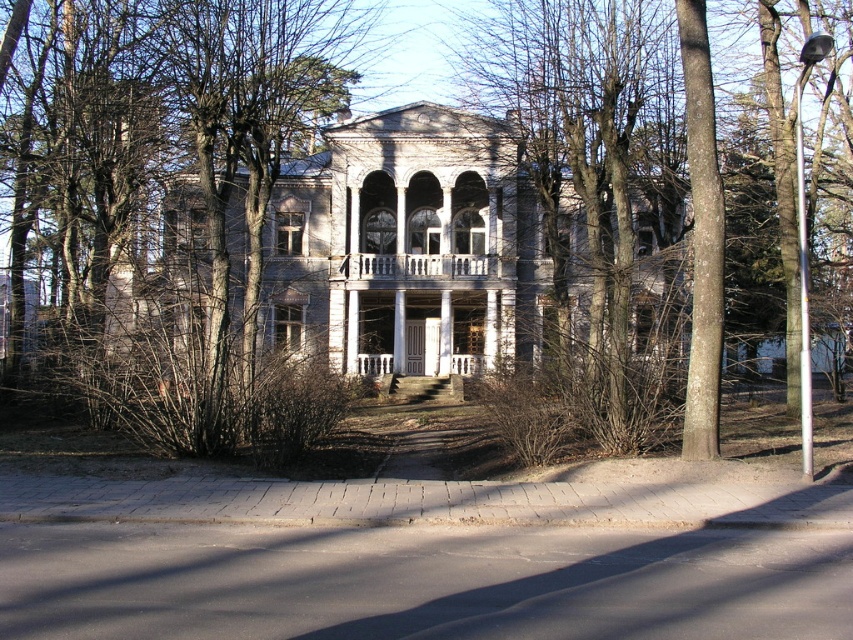
Question: Is brown bark tree at center thinner than white wooden porch at center?

Choices:
 (A) no
 (B) yes

Answer: (A)

Question: Does white wooden porch at center appear on the right side of white painted wood porch at center?

Choices:
 (A) no
 (B) yes

Answer: (B)

Question: Based on their relative distances, which object is farther from the brown bark tree at center?

Choices:
 (A) white painted wood porch at center
 (B) gray stone mansion at center
 (C) white wooden porch at center

Answer: (A)

Question: Which object is the farthest from the white painted wood porch at center?

Choices:
 (A) brown bark tree at center
 (B) white wooden porch at center

Answer: (A)

Question: Which point is farther to the camera?

Choices:
 (A) white wooden porch at center
 (B) brown bark tree at center
 (C) white painted wood porch at center
 (D) gray stone mansion at center

Answer: (A)

Question: Is brown bark tree at center thinner than gray stone mansion at center?

Choices:
 (A) no
 (B) yes

Answer: (A)